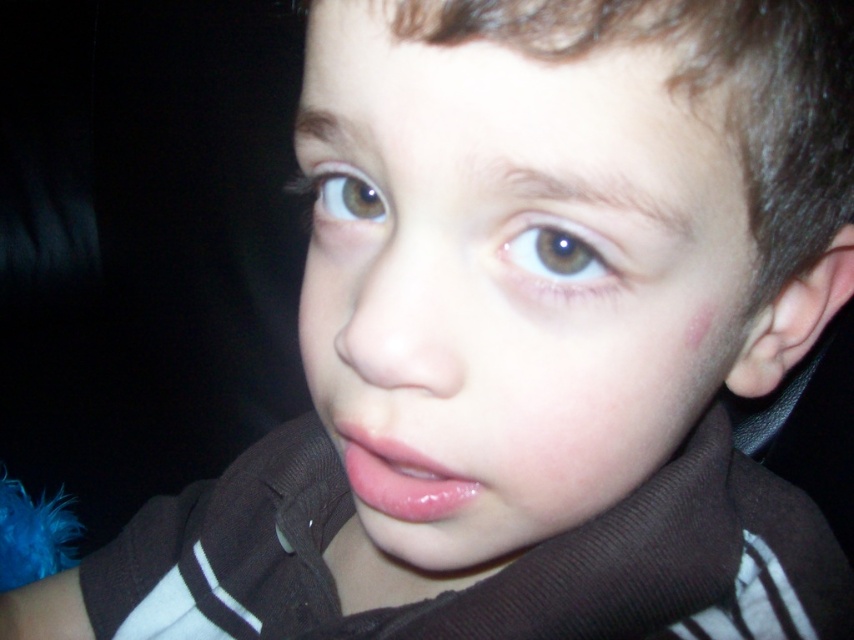
Who is lower down, brown glossy eye at upper center or brown matte eye at upper left?

brown glossy eye at upper center is below.

Image resolution: width=854 pixels, height=640 pixels. What are the coordinates of `brown glossy eye at upper center` in the screenshot? It's located at (560, 253).

Consider the image. Between smooth skin face at center and glossy pink lips at center, which one is positioned lower?

Positioned lower is smooth skin face at center.

Who is positioned more to the right, smooth skin face at center or glossy pink lips at center?

smooth skin face at center is more to the right.

From the picture: Who is more distant from viewer, (477, 378) or (411, 513)?

The point (411, 513) is behind.

Where is `smooth skin face at center`? smooth skin face at center is located at coordinates (510, 284).

Between point (361, 545) and point (319, 195), which one is positioned behind?

The point (361, 545) is behind.

Does smooth skin face at center lie behind brown matte eye at upper left?

That is False.

At what (x,y) coordinates should I click in order to perform the action: click on smooth skin face at center. Please return your answer as a coordinate pair (x, y). The height and width of the screenshot is (640, 854). Looking at the image, I should click on (510, 284).